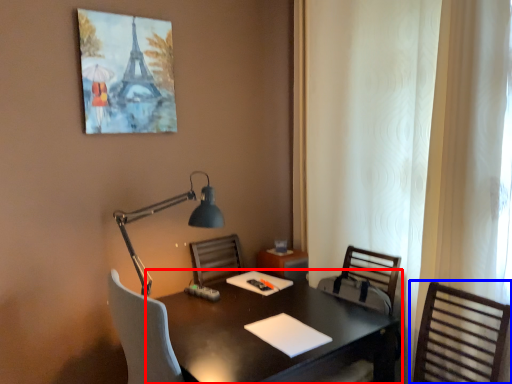
Question: Which of the following is the closest to the observer, desk (highlighted by a red box) or chair (highlighted by a blue box)?

Choices:
 (A) desk
 (B) chair

Answer: (B)